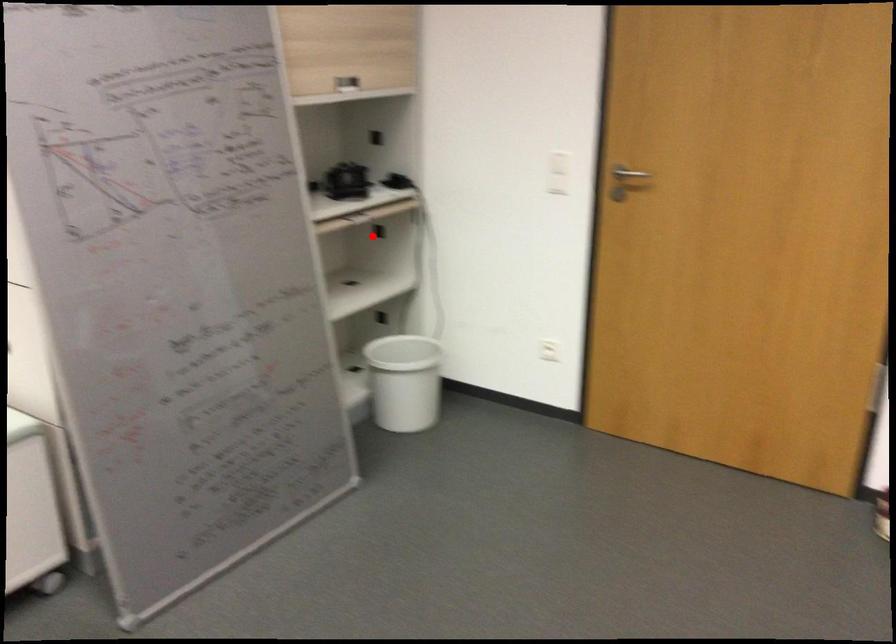
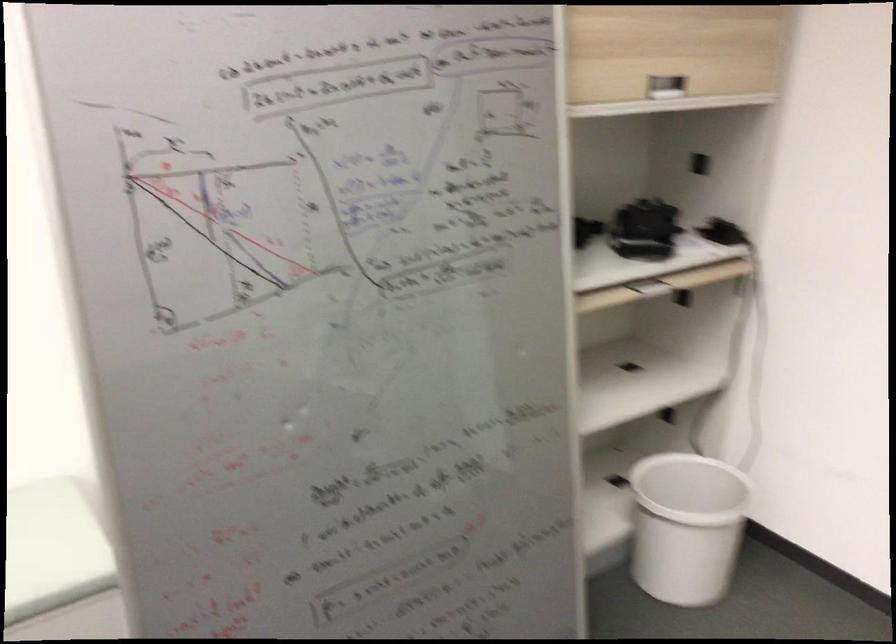
Question: I am providing you with two images of the same scene from different viewpoints. In image1, a red point is highlighted. Considering the same 3D point in image2, which of the following is correct?

Choices:
 (A) It is closer
 (B) It is farther

Answer: (A)